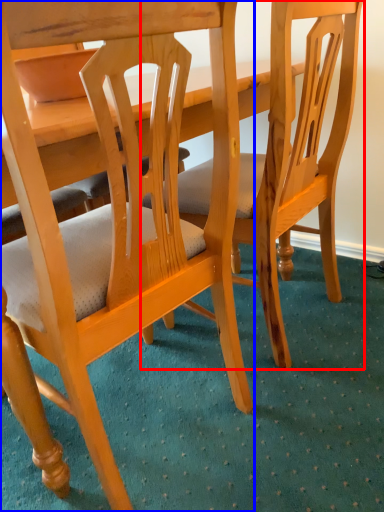
Question: Which point is closer to the camera, chair (highlighted by a red box) or chair (highlighted by a blue box)?

Choices:
 (A) chair
 (B) chair

Answer: (B)